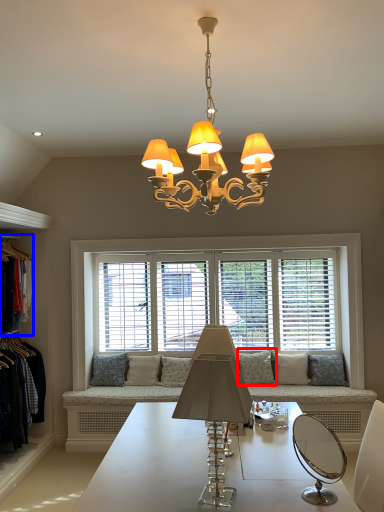
Question: Which object is further to the camera taking this photo, pillow (highlighted by a red box) or clothing (highlighted by a blue box)?

Choices:
 (A) pillow
 (B) clothing

Answer: (A)